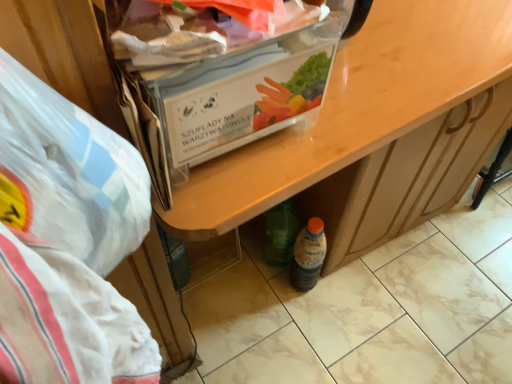
In order to face translucent plastic bottle at lower center, should I rotate leftwards or rightwards?

Turn right by 7.302 degrees to look at translucent plastic bottle at lower center.

Describe the element at coordinates (67, 241) in the screenshot. I see `white plastic bag at left` at that location.

What do you see at coordinates (355, 109) in the screenshot? I see `wooden desk at center` at bounding box center [355, 109].

In order to face clear plastic box at upper center, should I rotate leftwards or rightwards?

Rotate left and turn 12.246 degrees.

Where is `translucent plastic bottle at lower center`? translucent plastic bottle at lower center is located at coordinates (308, 255).

Could you tell me if clear plastic box at upper center is turned towards translucent plastic bottle at lower center?

No, clear plastic box at upper center is not facing towards translucent plastic bottle at lower center.

You are a GUI agent. You are given a task and a screenshot of the screen. Output one action in this format:
    pyautogui.click(x=<x>, y=<y>)
    Task: Click on the bottle lying below the clear plastic box at upper center (from the image's perspective)
    The image size is (512, 384).
    Given the screenshot: What is the action you would take?
    pyautogui.click(x=308, y=255)

Consider the image. Is clear plastic box at upper center not near translucent plastic bottle at lower center?

They are positioned close to each other.

Can you confirm if clear plastic box at upper center is taller than translucent plastic bottle at lower center?

No.

In terms of size, does wooden desk at center appear bigger or smaller than translucent plastic bottle at lower center?

Considering their sizes, wooden desk at center takes up more space than translucent plastic bottle at lower center.

Looking at their sizes, would you say wooden desk at center is wider or thinner than translucent plastic bottle at lower center?

In the image, wooden desk at center appears to be wider than translucent plastic bottle at lower center.

Does point (246, 168) come farther from viewer compared to point (311, 259)?

No.

From the image's perspective, does wooden desk at center appear lower than translucent plastic bottle at lower center?

No.

Is the position of white plastic bag at left more distant than that of wooden desk at center?

No, the depth of white plastic bag at left is less than that of wooden desk at center.

Which of these two, white plastic bag at left or wooden desk at center, is bigger?

Bigger between the two is wooden desk at center.

From a real-world perspective, which is physically above, white plastic bag at left or wooden desk at center?

In real-world perspective, white plastic bag at left is above.

Consider the image. Is translucent plastic bottle at lower center closer to camera compared to clear plastic box at upper center?

No, it is behind clear plastic box at upper center.

Is point (301, 286) closer or farther from the camera than point (264, 124)?

Point (301, 286) appears to be farther away from the viewer than point (264, 124).

At what (x,y) coordinates should I click in order to perform the action: click on box in front of the translucent plastic bottle at lower center. Please return your answer as a coordinate pair (x, y). The height and width of the screenshot is (384, 512). Looking at the image, I should click on (232, 78).

Between translucent plastic bottle at lower center and clear plastic box at upper center, which one has smaller size?

With smaller size is translucent plastic bottle at lower center.

From a real-world perspective, is translucent plastic bottle at lower center beneath white plastic bag at left?

Yes, from a real-world perspective, translucent plastic bottle at lower center is below white plastic bag at left.

Is translucent plastic bottle at lower center next to white plastic bag at left?

No.

Visually, is translucent plastic bottle at lower center positioned to the left or to the right of white plastic bag at left?

translucent plastic bottle at lower center is positioned on white plastic bag at left's right side.

Is white plastic bag at left inside translucent plastic bottle at lower center?

Definitely not — white plastic bag at left is not inside translucent plastic bottle at lower center.

Looking at this image, is wooden desk at center at the left side of clear plastic box at upper center?

Incorrect, wooden desk at center is not on the left side of clear plastic box at upper center.

Which is closer, (x=494, y=35) or (x=202, y=46)?

Point (x=494, y=35) is farther from the camera than point (x=202, y=46).

Is wooden desk at center not close to clear plastic box at upper center?

They are positioned close to each other.

Can you confirm if wooden desk at center is taller than clear plastic box at upper center?

Yes.

From the image's perspective, does white plastic bag at left appear lower than translucent plastic bottle at lower center?

Actually, white plastic bag at left appears above translucent plastic bottle at lower center in the image.

Is white plastic bag at left closer to the viewer compared to translucent plastic bottle at lower center?

Yes, white plastic bag at left is in front of translucent plastic bottle at lower center.

Is white plastic bag at left smaller than translucent plastic bottle at lower center?

No, white plastic bag at left is not smaller than translucent plastic bottle at lower center.

Considering the sizes of white plastic bag at left and translucent plastic bottle at lower center in the image, is white plastic bag at left taller or shorter than translucent plastic bottle at lower center?

Considering their sizes, white plastic bag at left has more height than translucent plastic bottle at lower center.

I want to click on bottle on the right of clear plastic box at upper center, so click(x=308, y=255).

I want to click on desk above the translucent plastic bottle at lower center (from the image's perspective), so click(x=355, y=109).

Considering their positions, is clear plastic box at upper center positioned closer to translucent plastic bottle at lower center than wooden desk at center?

wooden desk at center is closer to translucent plastic bottle at lower center.

When comparing their distances from clear plastic box at upper center, does white plastic bag at left or translucent plastic bottle at lower center seem further?

translucent plastic bottle at lower center is positioned further to the anchor clear plastic box at upper center.

From the image, which object appears to be nearer to clear plastic box at upper center, wooden desk at center or white plastic bag at left?

The object closer to clear plastic box at upper center is wooden desk at center.

When comparing their distances from translucent plastic bottle at lower center, does clear plastic box at upper center or white plastic bag at left seem closer?

clear plastic box at upper center lies closer to translucent plastic bottle at lower center than the other object.

When comparing their distances from wooden desk at center, does white plastic bag at left or translucent plastic bottle at lower center seem further?

Based on the image, translucent plastic bottle at lower center appears to be further to wooden desk at center.

When comparing their distances from translucent plastic bottle at lower center, does white plastic bag at left or clear plastic box at upper center seem further?

white plastic bag at left is further to translucent plastic bottle at lower center.

Considering their positions, is clear plastic box at upper center positioned closer to white plastic bag at left than translucent plastic bottle at lower center?

clear plastic box at upper center is closer to white plastic bag at left.

Which object lies further to the anchor point clear plastic box at upper center, translucent plastic bottle at lower center or white plastic bag at left?

translucent plastic bottle at lower center.

The image size is (512, 384). I want to click on box positioned between white plastic bag at left and translucent plastic bottle at lower center from near to far, so tap(232, 78).

Locate an element on the screen. The image size is (512, 384). desk between clear plastic box at upper center and translucent plastic bottle at lower center from front to back is located at coordinates (355, 109).

This screenshot has width=512, height=384. In order to click on waste situated between clear plastic box at upper center and wooden desk at center from left to right in this screenshot , I will do `click(67, 241)`.

Find the location of a particular element. desk between white plastic bag at left and translucent plastic bottle at lower center in the front-back direction is located at coordinates (355, 109).